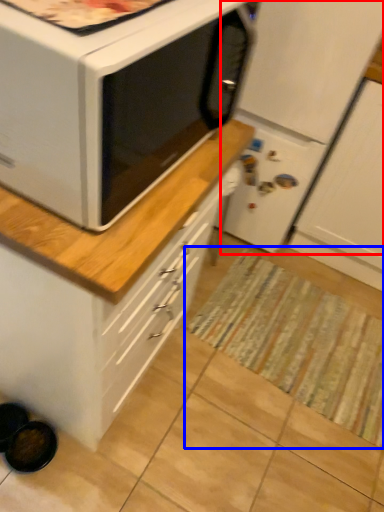
Question: Among these objects, which one is farthest to the camera, refrigerator (highlighted by a red box) or mat (highlighted by a blue box)?

Choices:
 (A) refrigerator
 (B) mat

Answer: (B)